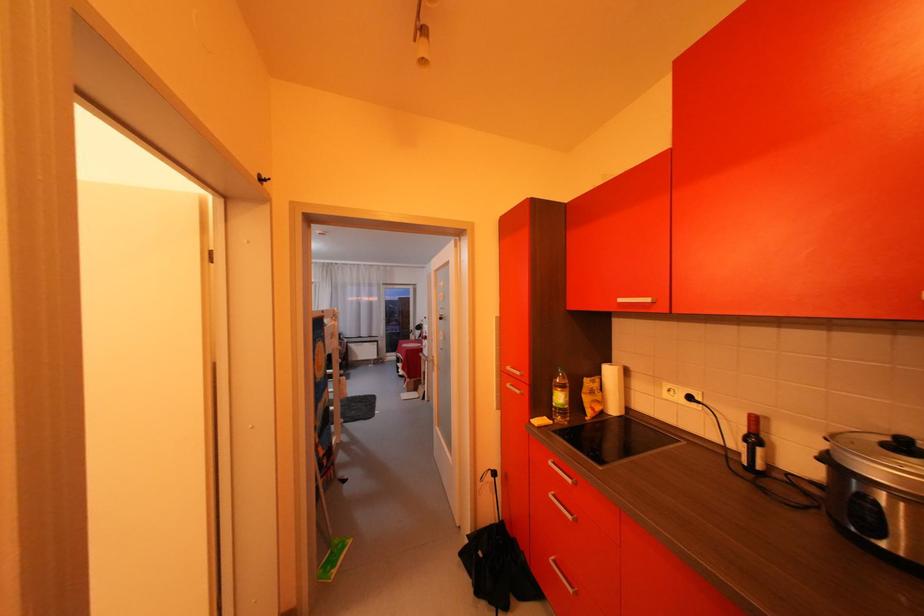
Find where to turn the white door handle. Please return your answer as a coordinate pair (x, y).

(431, 357)